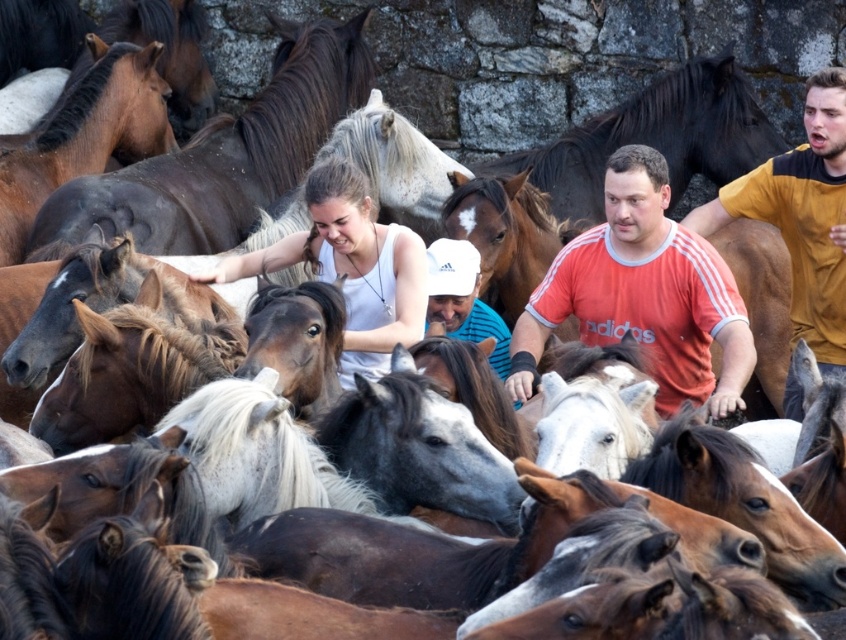
Question: Based on their relative distances, which object is nearer to the white matte tank top at center?

Choices:
 (A) orange cotton shirt at center
 (B) yellow cotton shirt at right

Answer: (A)

Question: Is the position of orange cotton shirt at center more distant than that of white matte cap at center?

Choices:
 (A) yes
 (B) no

Answer: (B)

Question: Which point is farther to the camera?

Choices:
 (A) (602, 252)
 (B) (481, 326)
 (C) (817, 225)
 (D) (424, 308)

Answer: (C)

Question: Can you confirm if yellow cotton shirt at right is positioned to the right of white matte tank top at center?

Choices:
 (A) yes
 (B) no

Answer: (A)

Question: Does orange cotton shirt at center have a smaller size compared to white matte tank top at center?

Choices:
 (A) yes
 (B) no

Answer: (B)

Question: Among these objects, which one is farthest from the camera?

Choices:
 (A) yellow cotton shirt at right
 (B) white matte cap at center
 (C) orange cotton shirt at center

Answer: (A)